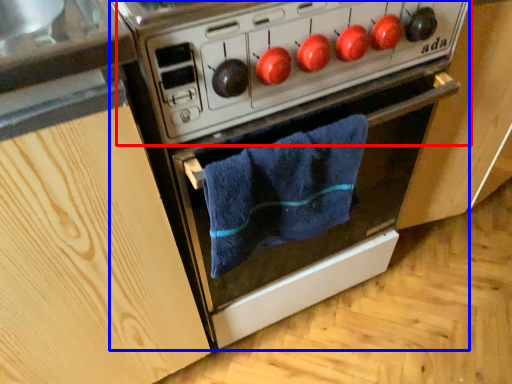
Question: Which object appears closest to the camera in this image, appliance (highlighted by a red box) or oven (highlighted by a blue box)?

Choices:
 (A) appliance
 (B) oven

Answer: (A)